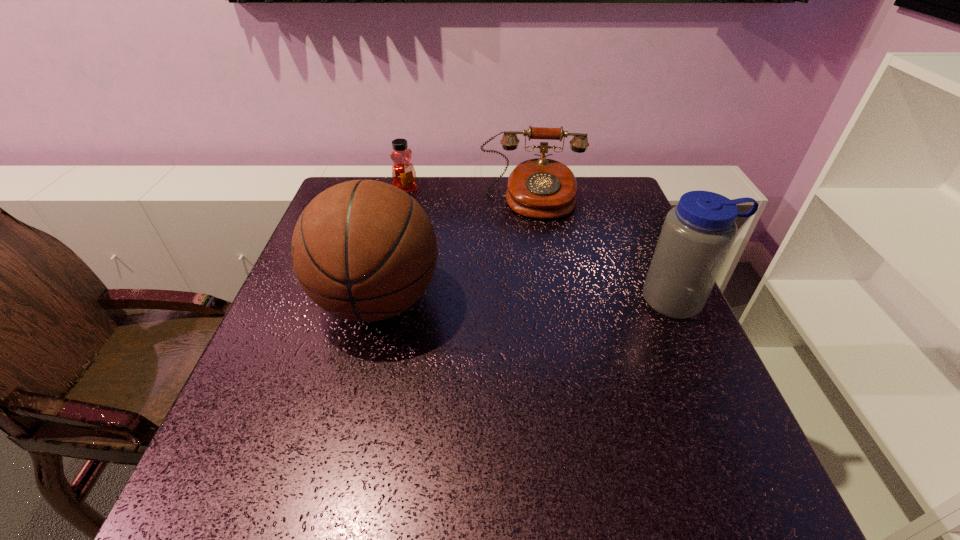
Where is `free space between the third tallest object and the shortest object`? This screenshot has height=540, width=960. free space between the third tallest object and the shortest object is located at coordinates (469, 195).

Identify the location of vacant space that's between the telephone and the basketball. The width and height of the screenshot is (960, 540). (455, 251).

This screenshot has width=960, height=540. I want to click on the second closest object to the rightmost object, so click(x=364, y=250).

Identify which object is the third nearest to the telephone. Please provide its 2D coordinates. Your answer should be formatted as a tuple, i.e. [(x, y)], where the tuple contains the x and y coordinates of a point satisfying the conditions above.

[(697, 235)]